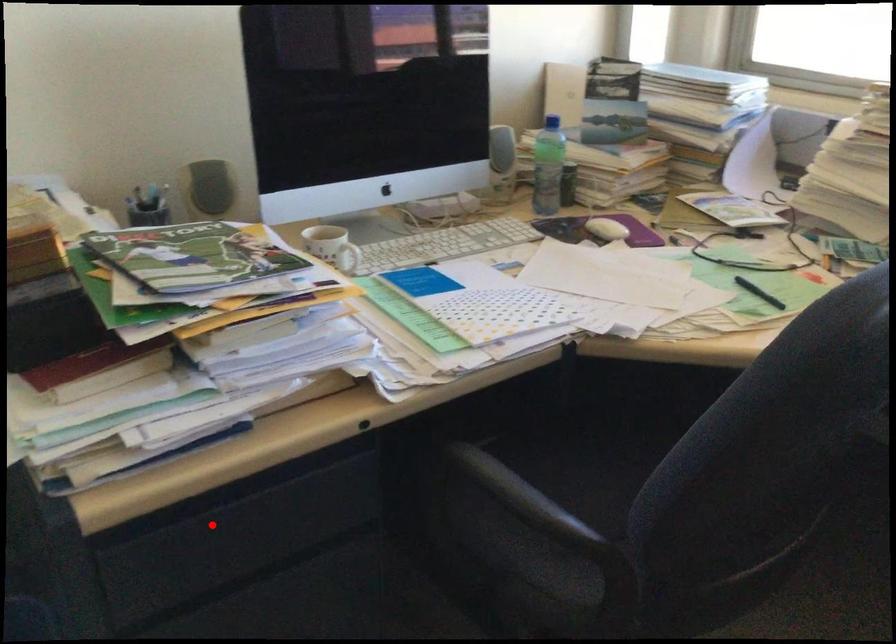
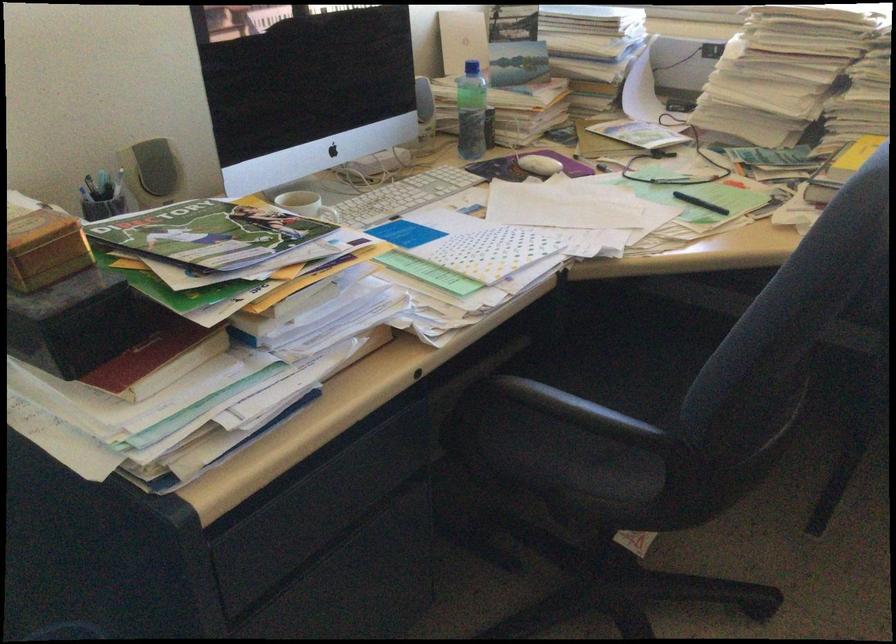
Locate, in the second image, the point that corresponds to the highlighted location in the first image.

(300, 491)